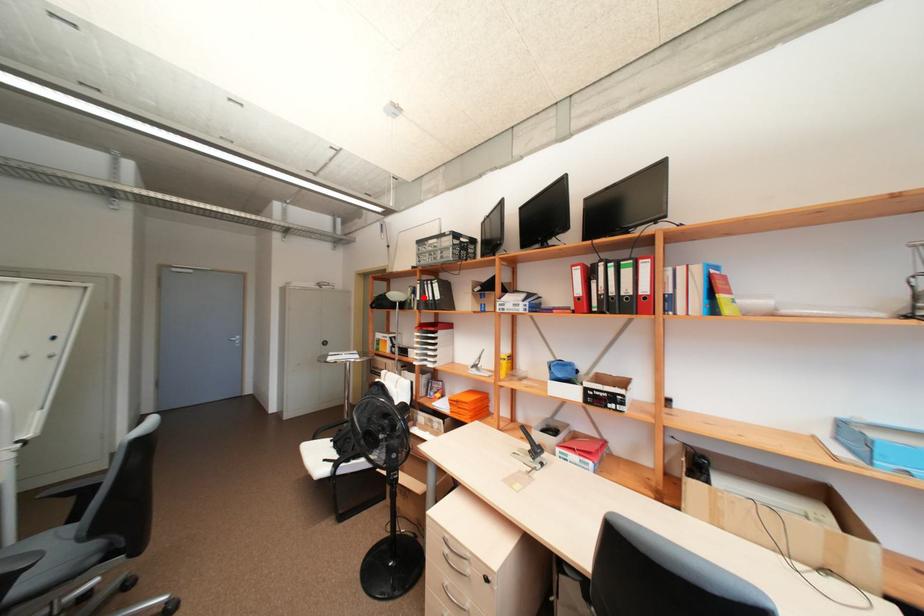
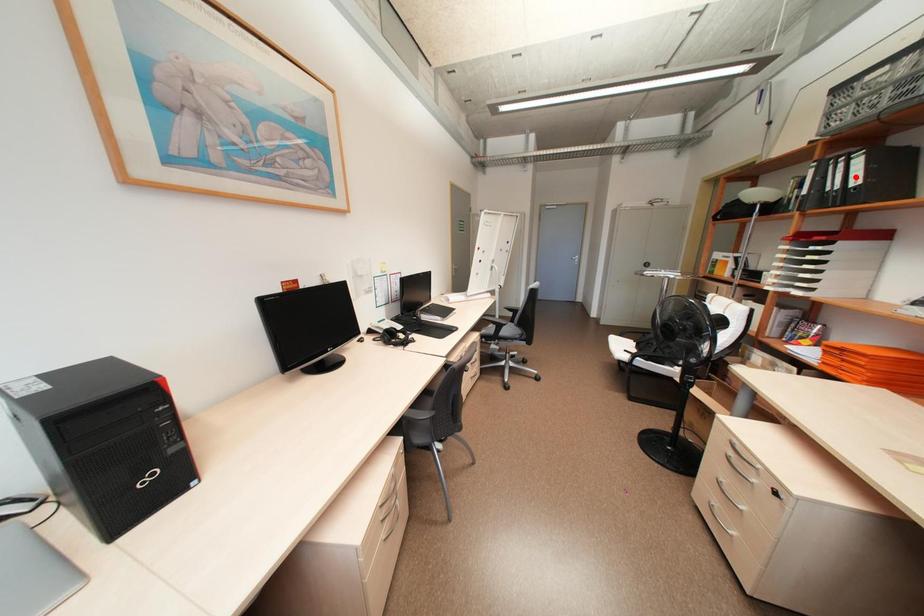
I am providing you with two images of the same scene from different viewpoints. A red point is marked on the first image and another point is marked on the second image. Do the highlighted points in image1 and image2 indicate the same real-world spot?

No